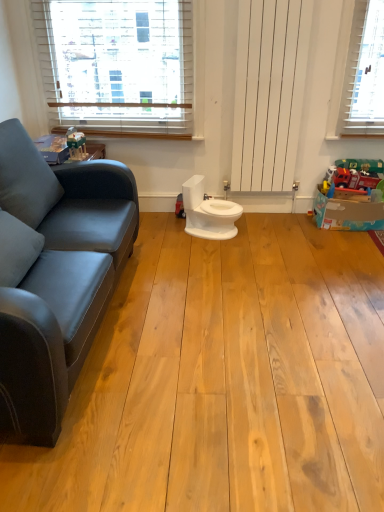
Where is `vacant space that is in between matte red fire truck at right, placed as the first toy when sorted from back to front, and white glossy toilet at center`? Image resolution: width=384 pixels, height=512 pixels. vacant space that is in between matte red fire truck at right, placed as the first toy when sorted from back to front, and white glossy toilet at center is located at coordinates (273, 225).